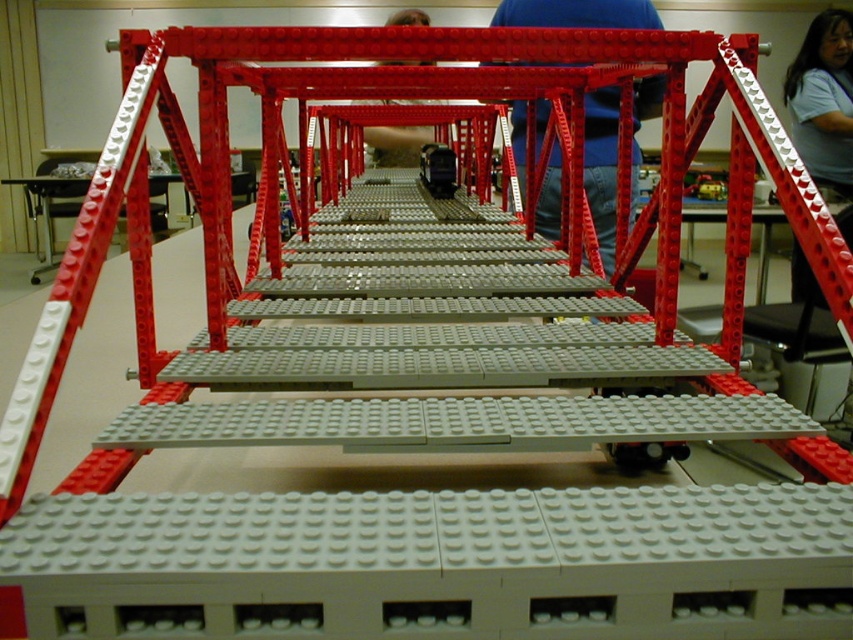
Question: Which point is farther to the camera?

Choices:
 (A) (810, 38)
 (B) (381, 134)
 (C) (634, 161)

Answer: (B)

Question: Can you confirm if blue fabric shirt at center is positioned above matte gray shirt at upper right?

Choices:
 (A) no
 (B) yes

Answer: (A)

Question: Which point is closer to the camera?

Choices:
 (A) matte plastic person at center
 (B) blue fabric shirt at center

Answer: (B)

Question: Is blue fabric shirt at center closer to the viewer compared to matte gray shirt at upper right?

Choices:
 (A) no
 (B) yes

Answer: (B)

Question: Which object is positioned farthest from the matte plastic person at center?

Choices:
 (A) blue fabric shirt at center
 (B) matte gray shirt at upper right

Answer: (A)

Question: Is blue fabric shirt at center smaller than matte plastic person at center?

Choices:
 (A) no
 (B) yes

Answer: (A)